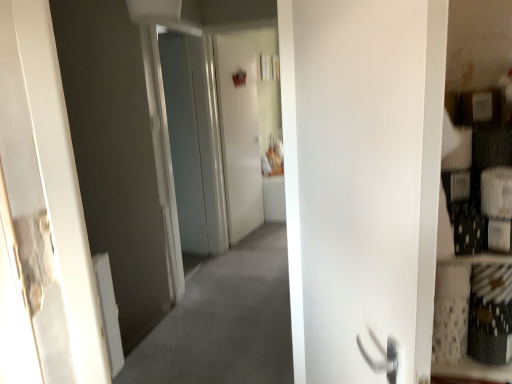
Question: Which direction should I rotate to face transparent glass door at center, which appears as the second screen door when viewed from the right, — up or down?

Choices:
 (A) down
 (B) up

Answer: (B)

Question: Is white matte door at right thinner than transparent glass door at center, arranged as the 1th screen door when viewed from the left?

Choices:
 (A) yes
 (B) no

Answer: (B)

Question: Is white matte door at right smaller than transparent glass door at center, which appears as the second screen door when viewed from the right?

Choices:
 (A) no
 (B) yes

Answer: (B)

Question: Is white matte door at right far from transparent glass door at center, which appears as the second screen door when viewed from the right?

Choices:
 (A) yes
 (B) no

Answer: (A)

Question: From the image's perspective, is white matte door at right beneath transparent glass door at center, which appears as the second screen door when viewed from the right?

Choices:
 (A) no
 (B) yes

Answer: (B)

Question: From the image's perspective, does white matte door at right appear higher than transparent glass door at center, which appears as the second screen door when viewed from the right?

Choices:
 (A) no
 (B) yes

Answer: (A)

Question: Is white matte door at right further to the viewer compared to transparent glass door at center, arranged as the 1th screen door when viewed from the left?

Choices:
 (A) no
 (B) yes

Answer: (A)

Question: Can you confirm if white glossy door at center, which is counted as the 1th screen door, starting from the right, is bigger than transparent glass door at center, which appears as the second screen door when viewed from the right?

Choices:
 (A) no
 (B) yes

Answer: (A)

Question: Considering the relative positions of white glossy door at center, the 2th screen door viewed from the left, and transparent glass door at center, which appears as the second screen door when viewed from the right, in the image provided, is white glossy door at center, the 2th screen door viewed from the left, behind transparent glass door at center, which appears as the second screen door when viewed from the right,?

Choices:
 (A) yes
 (B) no

Answer: (A)

Question: From the image's perspective, is white glossy door at center, the 2th screen door viewed from the left, located beneath transparent glass door at center, arranged as the 1th screen door when viewed from the left?

Choices:
 (A) yes
 (B) no

Answer: (B)

Question: From a real-world perspective, does white glossy door at center, which is counted as the 1th screen door, starting from the right, sit lower than transparent glass door at center, which appears as the second screen door when viewed from the right?

Choices:
 (A) yes
 (B) no

Answer: (A)

Question: Is transparent glass door at center, arranged as the 1th screen door when viewed from the left, a part of white glossy door at center, which is counted as the 1th screen door, starting from the right?

Choices:
 (A) no
 (B) yes

Answer: (A)

Question: From the image's perspective, is white glossy door at center, the 2th screen door viewed from the left, on top of transparent glass door at center, which appears as the second screen door when viewed from the right?

Choices:
 (A) no
 (B) yes

Answer: (B)

Question: Considering the relative positions of white matte door at right and white glossy door at center, the 2th screen door viewed from the left, in the image provided, is white matte door at right to the left of white glossy door at center, the 2th screen door viewed from the left, from the viewer's perspective?

Choices:
 (A) yes
 (B) no

Answer: (B)